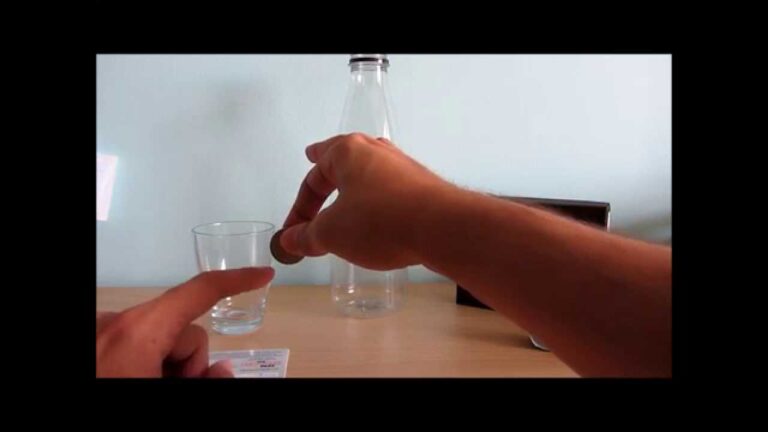
The width and height of the screenshot is (768, 432). In order to click on wall in this screenshot , I will do `click(263, 113)`.